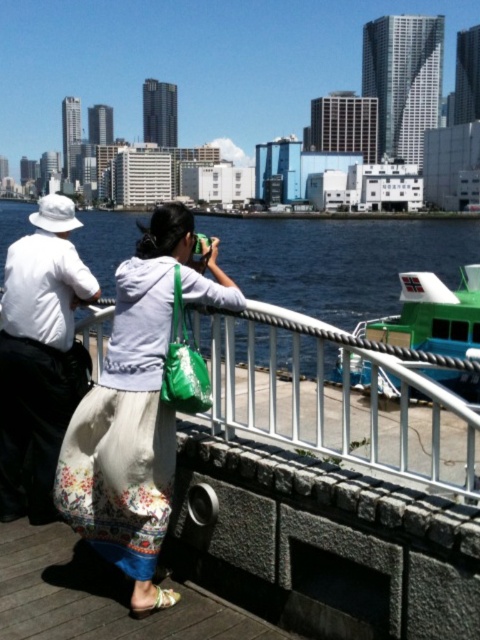
Question: Among these points, which one is farthest from the camera?

Choices:
 (A) (428, 236)
 (B) (7, 433)

Answer: (A)

Question: Can you confirm if white metal rail at center is thinner than white matte hat at upper left?

Choices:
 (A) no
 (B) yes

Answer: (A)

Question: Can you confirm if white cotton skirt at center is smaller than white matte hat at upper left?

Choices:
 (A) yes
 (B) no

Answer: (B)

Question: Considering the relative positions of blue water at center and green plastic boat at right in the image provided, where is blue water at center located with respect to green plastic boat at right?

Choices:
 (A) above
 (B) below

Answer: (A)

Question: Which object appears farthest from the camera in this image?

Choices:
 (A) blue water at center
 (B) green plastic boat at right
 (C) white cotton skirt at center
 (D) white metal rail at center

Answer: (A)

Question: Which of these objects is positioned farthest from the blue water at center?

Choices:
 (A) green plastic boat at right
 (B) white metal rail at center
 (C) white matte hat at upper left
 (D) white cotton skirt at center

Answer: (C)